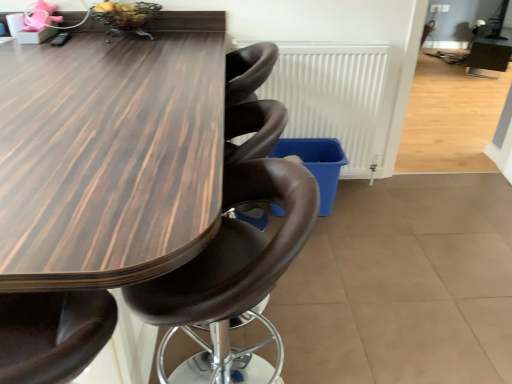
Question: Considering the relative sizes of white matte radiator at center and wooden table at center in the image provided, is white matte radiator at center bigger than wooden table at center?

Choices:
 (A) yes
 (B) no

Answer: (B)

Question: Can you confirm if white matte radiator at center is positioned to the left of wooden table at center?

Choices:
 (A) yes
 (B) no

Answer: (B)

Question: From the image's perspective, is white matte radiator at center located above wooden table at center?

Choices:
 (A) no
 (B) yes

Answer: (B)

Question: Does white matte radiator at center come behind wooden table at center?

Choices:
 (A) no
 (B) yes

Answer: (B)

Question: Does white matte radiator at center turn towards wooden table at center?

Choices:
 (A) no
 (B) yes

Answer: (A)

Question: Is wooden table at center spatially inside brown leather chair at center, or outside of it?

Choices:
 (A) outside
 (B) inside

Answer: (A)

Question: In terms of width, does wooden table at center look wider or thinner when compared to brown leather chair at center?

Choices:
 (A) wide
 (B) thin

Answer: (A)

Question: Is point (94, 44) positioned closer to the camera than point (190, 314)?

Choices:
 (A) closer
 (B) farther

Answer: (B)

Question: From the image's perspective, is wooden table at center above or below brown leather chair at center?

Choices:
 (A) below
 (B) above

Answer: (B)

Question: Is white matte radiator at center situated inside brown leather chair at center or outside?

Choices:
 (A) inside
 (B) outside

Answer: (B)

Question: From the image's perspective, is white matte radiator at center above or below brown leather chair at center?

Choices:
 (A) below
 (B) above

Answer: (B)

Question: Considering the positions of white matte radiator at center and brown leather chair at center in the image, is white matte radiator at center wider or thinner than brown leather chair at center?

Choices:
 (A) wide
 (B) thin

Answer: (B)

Question: Relative to brown leather chair at center, is white matte radiator at center in front or behind?

Choices:
 (A) behind
 (B) front

Answer: (A)

Question: In terms of size, does white matte radiator at center appear bigger or smaller than wooden table at center?

Choices:
 (A) small
 (B) big

Answer: (A)

Question: Based on their positions, is white matte radiator at center located to the left or right of wooden table at center?

Choices:
 (A) right
 (B) left

Answer: (A)